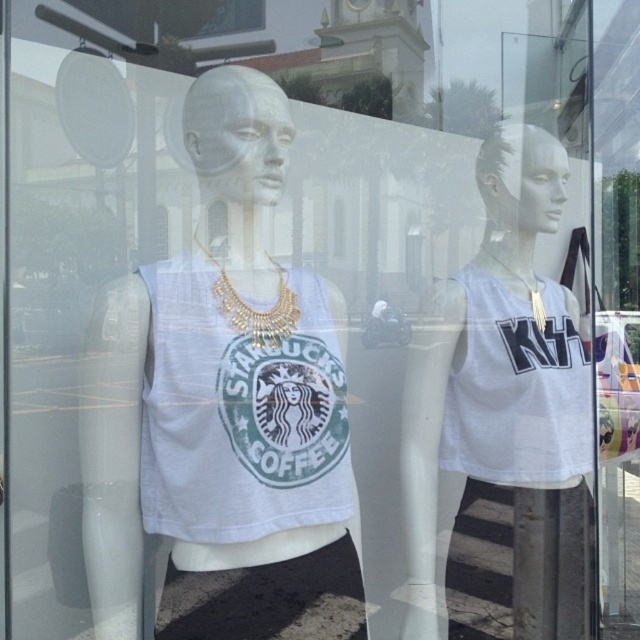
Question: Which point is farther to the camera?

Choices:
 (A) white matte tank top at right
 (B) gold metallic necklace at center

Answer: (A)

Question: Can you confirm if gold metallic necklace at center is positioned above gold metallic necklace at upper right?

Choices:
 (A) no
 (B) yes

Answer: (A)

Question: Does white jersey at right have a greater width compared to gold metallic necklace at center?

Choices:
 (A) yes
 (B) no

Answer: (A)

Question: Which point is closer to the camera taking this photo?

Choices:
 (A) (493, 256)
 (B) (298, 428)
 (C) (552, 163)

Answer: (B)

Question: Which object is positioned closest to the white jersey at right?

Choices:
 (A) white matte tank top at right
 (B) white fabric tank top at center

Answer: (A)

Question: Is white matte tank top at center to the right of white jersey at right from the viewer's perspective?

Choices:
 (A) no
 (B) yes

Answer: (A)